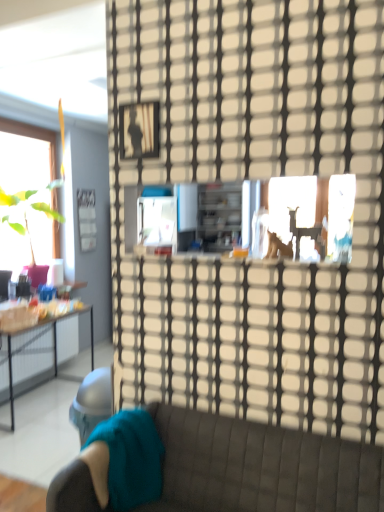
Question: Looking at the image, does teal fabric pillow at lower left seem bigger or smaller compared to velvet teal studio couch at lower left?

Choices:
 (A) big
 (B) small

Answer: (B)

Question: Is teal fabric pillow at lower left spatially inside velvet teal studio couch at lower left, or outside of it?

Choices:
 (A) inside
 (B) outside

Answer: (A)

Question: Which object is positioned closest to the velvet teal studio couch at lower left?

Choices:
 (A) metallic silver picture frame at upper center
 (B) teal fabric pillow at lower left
 (C) transparent glass door at center

Answer: (B)

Question: Which of these objects is positioned farthest from the metallic silver picture frame at upper center?

Choices:
 (A) transparent glass door at center
 (B) velvet teal studio couch at lower left
 (C) teal fabric pillow at lower left

Answer: (B)